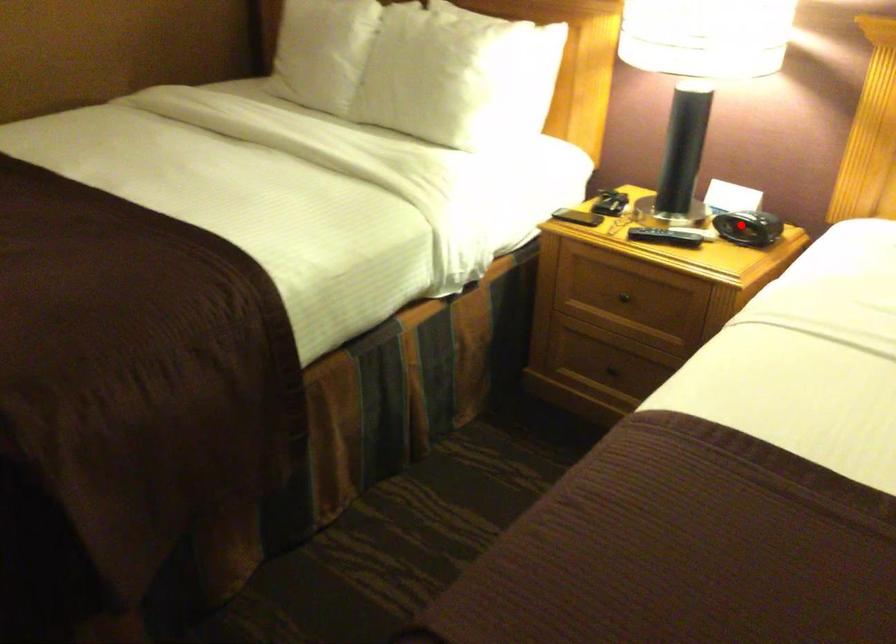
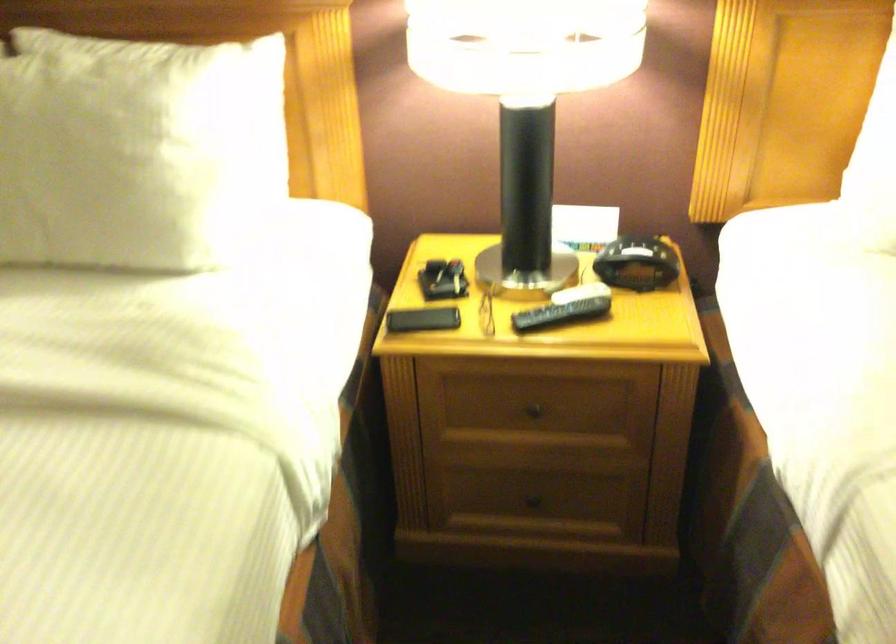
Question: A red point is marked in image1. In image2, is the corresponding 3D point closer to the camera or farther? Reply with the corresponding letter.

Choices:
 (A) The corresponding 3D point is closer.
 (B) The corresponding 3D point is farther.

Answer: (A)